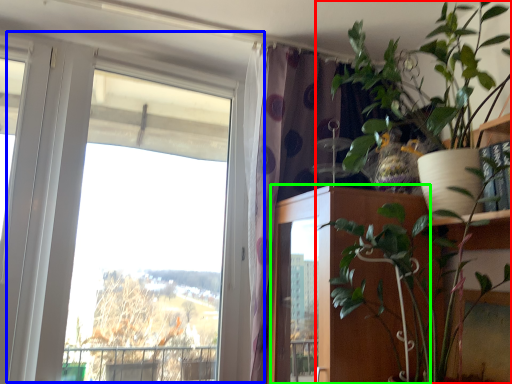
Question: Estimate the real-world distances between objects in this image. Which object is closer to houseplant (highlighted by a red box), window (highlighted by a blue box) or door (highlighted by a green box)?

Choices:
 (A) window
 (B) door

Answer: (B)